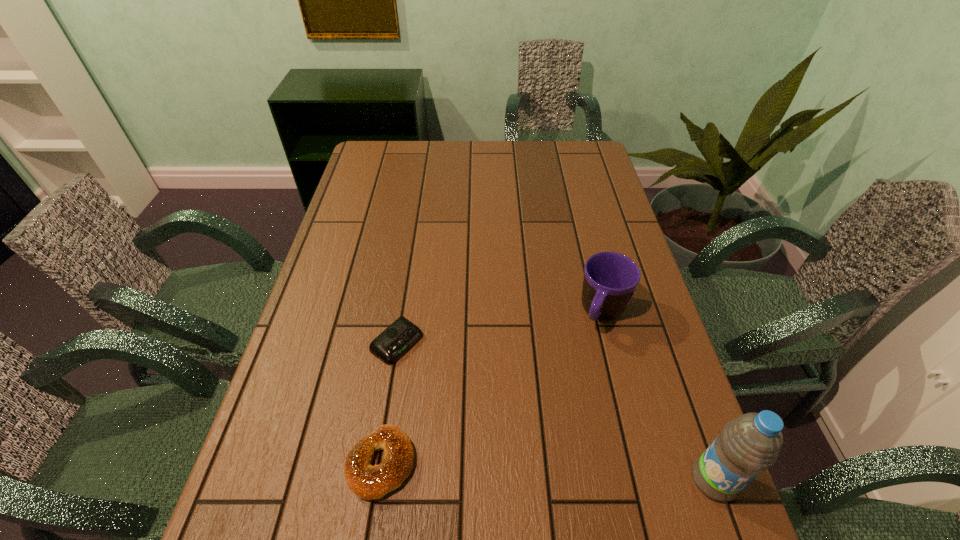
I want to click on vacant space that is in between the bagel and the alarm clock, so click(389, 403).

You are a GUI agent. You are given a task and a screenshot of the screen. Output one action in this format:
    pyautogui.click(x=<x>, y=<y>)
    Task: Click on the vacant area between the rightmost object and the bagel
    This screenshot has height=540, width=960.
    Given the screenshot: What is the action you would take?
    pyautogui.click(x=547, y=471)

Locate an element on the screen. free space between the shortest object and the third tallest object is located at coordinates (389, 403).

This screenshot has width=960, height=540. Identify the location of object that stands as the third closest to the water bottle. (390, 345).

Identify which object is the second closest to the third shortest object. Please provide its 2D coordinates. Your answer should be formatted as a tuple, i.e. [(x, y)], where the tuple contains the x and y coordinates of a point satisfying the conditions above.

[(390, 345)]

Find the location of `vacant point that satisfies the following two spatial constraints: 1. on the front side of the bagel; 2. on the left side of the shortest object`. vacant point that satisfies the following two spatial constraints: 1. on the front side of the bagel; 2. on the left side of the shortest object is located at coordinates [378, 463].